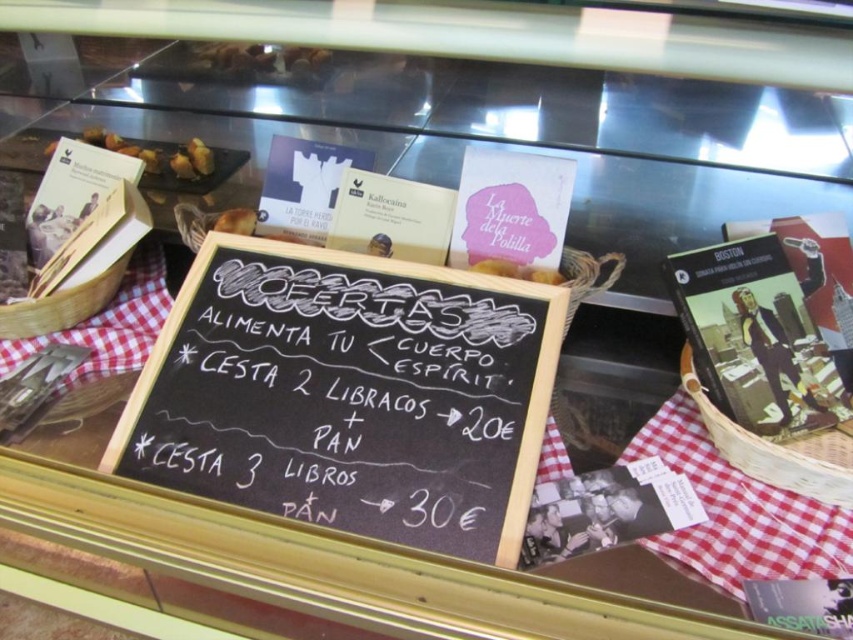
Question: Which point is closer to the camera?

Choices:
 (A) [519, 400]
 (B) [231, 218]

Answer: (A)

Question: Which of these objects is positioned farthest from the golden brown bread at center?

Choices:
 (A) black chalkboard at center
 (B) matte brown bread at upper left

Answer: (B)

Question: Which object is the closest to the golden brown bread at center?

Choices:
 (A) matte brown bread at upper left
 (B) black chalkboard at center

Answer: (B)

Question: Can you confirm if black chalkboard at center is smaller than matte brown bread at upper left?

Choices:
 (A) yes
 (B) no

Answer: (B)

Question: Is black chalkboard at center thinner than matte brown bread at upper left?

Choices:
 (A) no
 (B) yes

Answer: (A)

Question: Does golden brown bread at center appear on the right side of matte brown bread at upper left?

Choices:
 (A) no
 (B) yes

Answer: (B)